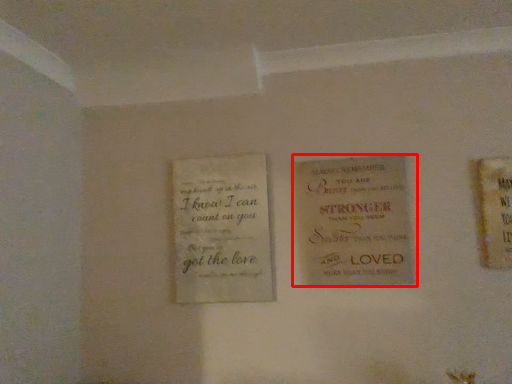
Question: Where is book (annotated by the red box) located in relation to book in the image?

Choices:
 (A) left
 (B) right

Answer: (B)